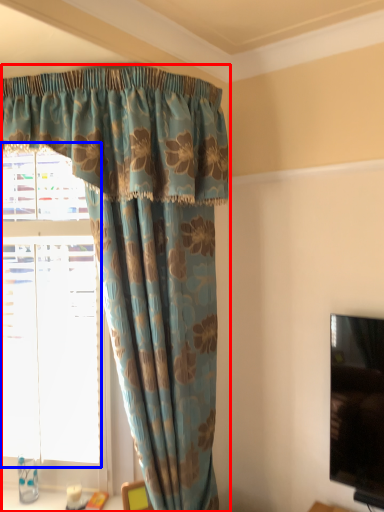
Question: Which of the following is the closest to the observer, curtain (highlighted by a red box) or bay window (highlighted by a blue box)?

Choices:
 (A) curtain
 (B) bay window

Answer: (A)